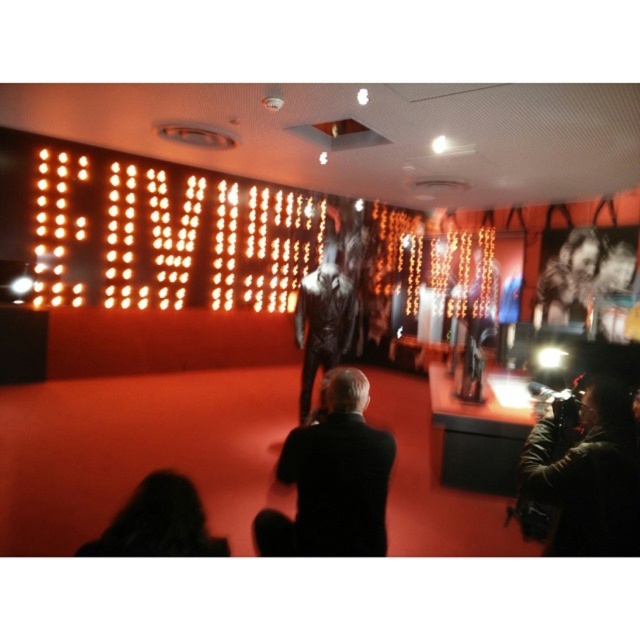
Between point (602, 500) and point (547, 273), which one is positioned behind?

Positioned behind is point (547, 273).

Identify the location of dark brown leather jacket at lower right. (582, 476).

Is black suit at center to the right of dark hair at lower left from the viewer's perspective?

Correct, you'll find black suit at center to the right of dark hair at lower left.

Is point (262, 548) more distant than point (125, 516)?

Yes, it is.

Identify the location of black suit at center. The image size is (640, 640). (332, 477).

Does dark brown leather jacket at lower right have a greater height compared to dark hair at lower left?

Correct, dark brown leather jacket at lower right is much taller as dark hair at lower left.

Is dark brown leather jacket at lower right to the right of dark hair at lower left from the viewer's perspective?

Correct, you'll find dark brown leather jacket at lower right to the right of dark hair at lower left.

Locate an element on the screen. dark brown leather jacket at lower right is located at coordinates (582, 476).